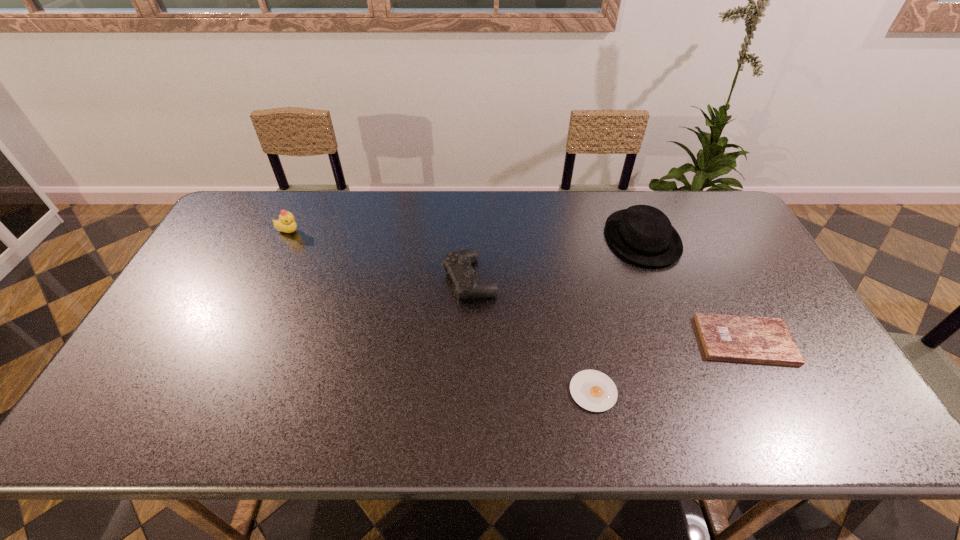
Find the location of a particular element. vacant space at the right edge of the desktop is located at coordinates tap(772, 290).

You are a GUI agent. You are given a task and a screenshot of the screen. Output one action in this format:
    pyautogui.click(x=<x>, y=<y>)
    Task: Click on the vacant space at the near right corner of the desktop
    
    Given the screenshot: What is the action you would take?
    pyautogui.click(x=837, y=415)

The width and height of the screenshot is (960, 540). I want to click on free point between the third shortest object and the second shortest object, so click(x=608, y=309).

Find the location of a particular element. This screenshot has height=540, width=960. free point between the fedora and the leftmost object is located at coordinates (466, 235).

The height and width of the screenshot is (540, 960). I want to click on vacant region between the duckling and the control, so click(x=379, y=255).

At what (x,y) coordinates should I click in order to perform the action: click on free area in between the fedora and the control. Please return your answer as a coordinate pair (x, y). Looking at the image, I should click on (556, 259).

Where is `free space between the fedora and the Bible`? free space between the fedora and the Bible is located at coordinates (694, 289).

Image resolution: width=960 pixels, height=540 pixels. Find the location of `free spot between the duckling and the fedora`. free spot between the duckling and the fedora is located at coordinates (466, 235).

Where is `free space between the Bible and the duckling`? The width and height of the screenshot is (960, 540). free space between the Bible and the duckling is located at coordinates (516, 286).

At what (x,y) coordinates should I click in order to perform the action: click on unoccupied area between the shortest object and the second shortest object. Please return your answer as a coordinate pair (x, y). The image size is (960, 540). Looking at the image, I should click on point(669,366).